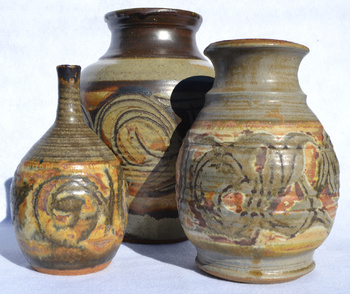
Locate an element on the screen. The image size is (350, 294). small clay pot is located at coordinates (70, 192).